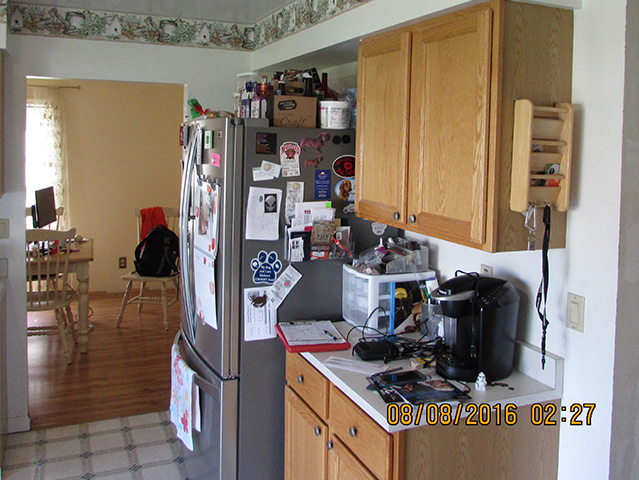
The width and height of the screenshot is (639, 480). What are the coordinates of `light switch` in the screenshot? It's located at (572, 315).